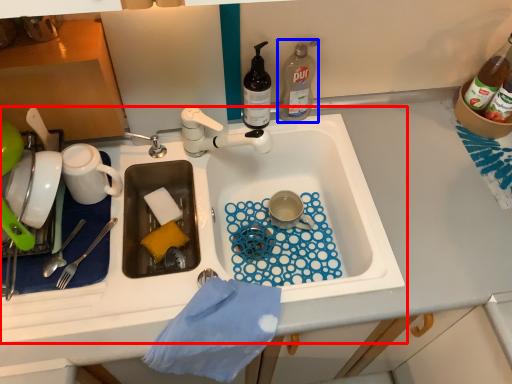
Question: Which point is further to the camera, sink (highlighted by a red box) or bottle (highlighted by a blue box)?

Choices:
 (A) sink
 (B) bottle

Answer: (B)